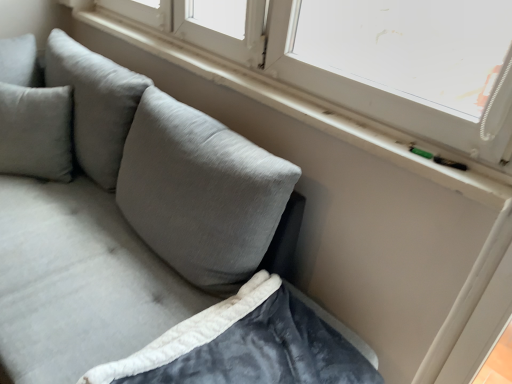
Question: From a real-world perspective, is white plastic window at upper right positioned over velvet gray couch at lower left based on gravity?

Choices:
 (A) no
 (B) yes

Answer: (B)

Question: Is velvet gray couch at lower left completely or partially inside white plastic window at upper right?

Choices:
 (A) no
 (B) yes

Answer: (A)

Question: Is the depth of white plastic window at upper right greater than that of velvet gray couch at lower left?

Choices:
 (A) no
 (B) yes

Answer: (B)

Question: Can you confirm if white plastic window at upper right is positioned to the right of velvet gray couch at lower left?

Choices:
 (A) no
 (B) yes

Answer: (B)

Question: Is white plastic window at upper right not inside velvet gray couch at lower left?

Choices:
 (A) no
 (B) yes

Answer: (B)

Question: Are white plastic window at upper right and velvet gray couch at lower left located far from each other?

Choices:
 (A) no
 (B) yes

Answer: (A)

Question: Is velvety dark gray blanket at lower left positioned beyond the bounds of white plastic window at upper right?

Choices:
 (A) no
 (B) yes

Answer: (B)

Question: Is velvety dark gray blanket at lower left to the left of white plastic window at upper right from the viewer's perspective?

Choices:
 (A) no
 (B) yes

Answer: (A)

Question: Is velvety dark gray blanket at lower left facing away from white plastic window at upper right?

Choices:
 (A) no
 (B) yes

Answer: (A)

Question: From the image's perspective, is velvety dark gray blanket at lower left located above white plastic window at upper right?

Choices:
 (A) no
 (B) yes

Answer: (A)

Question: Does velvety dark gray blanket at lower left have a lesser width compared to white plastic window at upper right?

Choices:
 (A) no
 (B) yes

Answer: (A)

Question: Is velvety dark gray blanket at lower left taller than white plastic window at upper right?

Choices:
 (A) yes
 (B) no

Answer: (B)

Question: Would you say velvet gray couch at lower left is part of velvety dark gray blanket at lower left's contents?

Choices:
 (A) yes
 (B) no

Answer: (B)